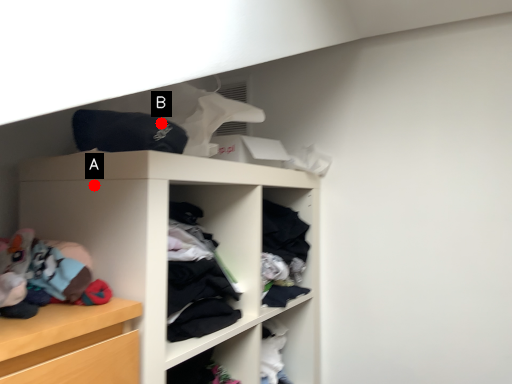
Question: Two points are circled on the image, labeled by A and B beside each circle. Which point is closer to the camera?

Choices:
 (A) A is closer
 (B) B is closer

Answer: (A)